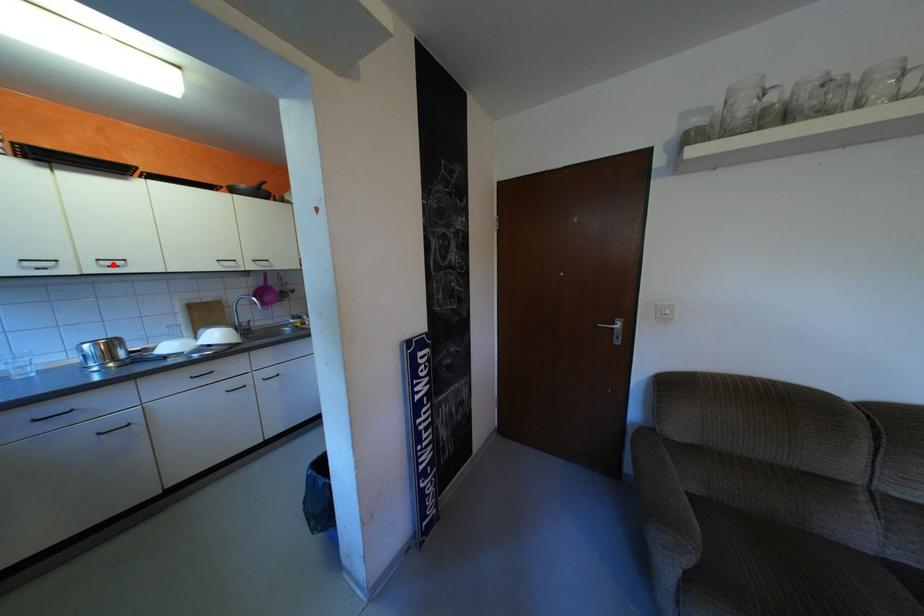
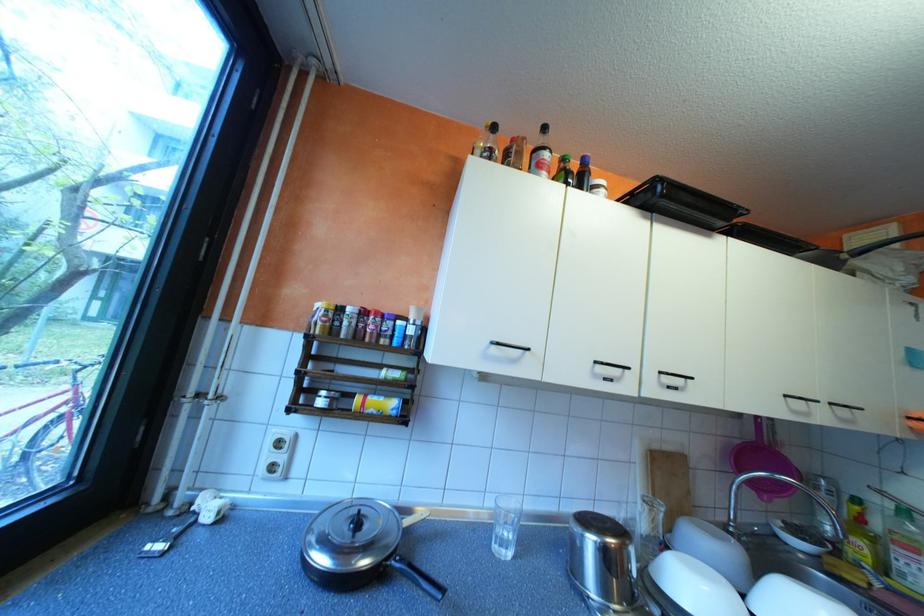
Where in the second image is the point corresponding to the highlighted location from the first image?

(673, 383)